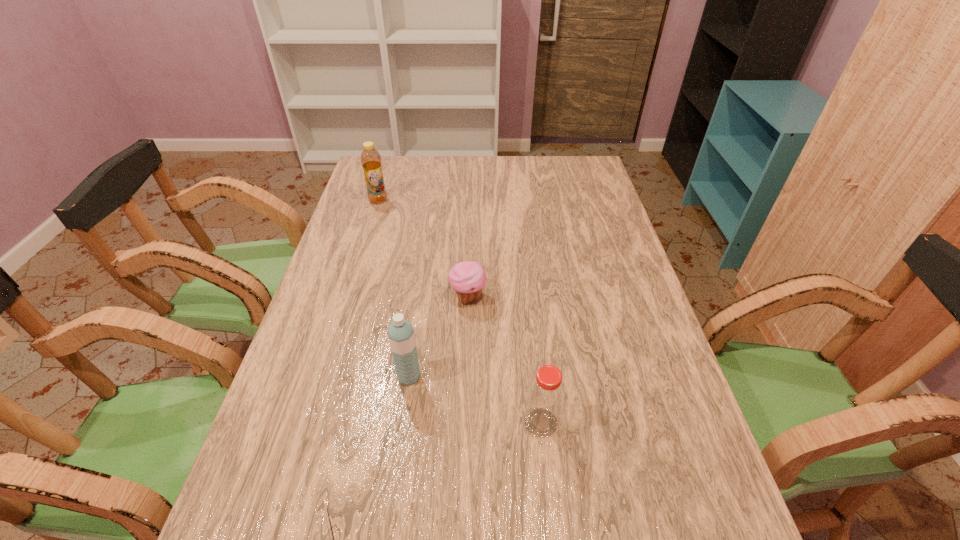
At what (x,y) coordinates should I click in order to perform the action: click on vacant space situated 0.220m on the left of the nearer bottle. Please return your answer as a coordinate pair (x, y). Looking at the image, I should click on (419, 422).

The width and height of the screenshot is (960, 540). I want to click on free region located on the right of the second farthest object, so click(x=564, y=297).

Identify the location of object located in the left edge section of the desktop. (371, 162).

Locate an element on the screen. free space at the far edge is located at coordinates (512, 157).

In the image, there is a desktop. Where is `vacant space at the left edge`? Image resolution: width=960 pixels, height=540 pixels. vacant space at the left edge is located at coordinates (351, 300).

In the image, there is a desktop. At what (x,y) coordinates should I click in order to perform the action: click on free space at the right edge. Please return your answer as a coordinate pair (x, y). This screenshot has height=540, width=960. Looking at the image, I should click on (652, 318).

Locate an element on the screen. This screenshot has height=540, width=960. free space between the cupcake and the third object from left to right is located at coordinates (439, 337).

Where is `free space between the right bottle and the third nearest object`? The width and height of the screenshot is (960, 540). free space between the right bottle and the third nearest object is located at coordinates (475, 400).

Identify the location of free space between the taller bottle and the fourth farthest object. (460, 312).

The height and width of the screenshot is (540, 960). What are the coordinates of `free spot between the third nearest object and the farthest object` in the screenshot? It's located at (394, 288).